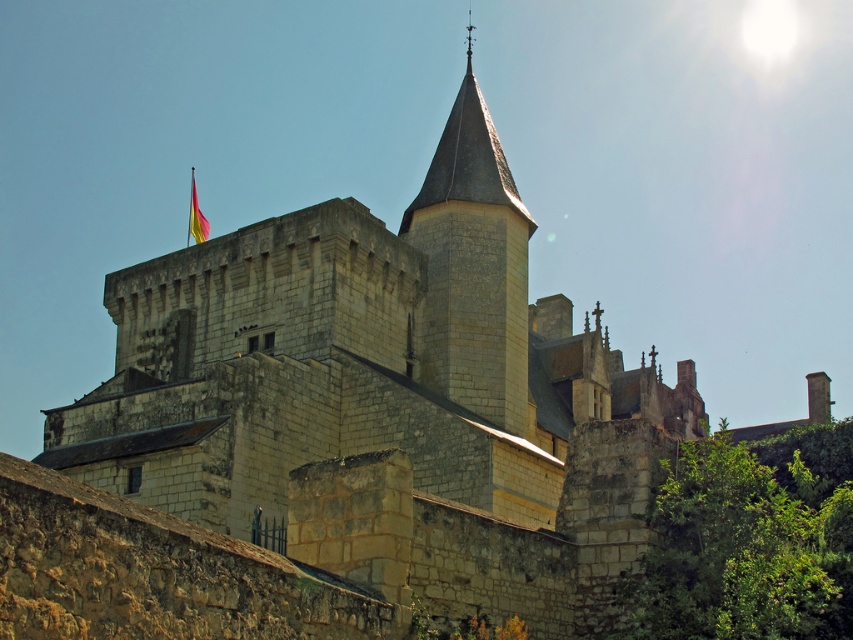
Question: Can you confirm if stone steeple at upper center is positioned to the left of silky yellow flag at upper center?

Choices:
 (A) yes
 (B) no

Answer: (B)

Question: Which point is closer to the camera?

Choices:
 (A) stone steeple at upper center
 (B) silky yellow flag at upper center

Answer: (A)

Question: Which of the following is the closest to the observer?

Choices:
 (A) (450, 376)
 (B) (198, 237)

Answer: (A)

Question: Is stone steeple at upper center to the right of silky yellow flag at upper center from the viewer's perspective?

Choices:
 (A) yes
 (B) no

Answer: (A)

Question: Can you confirm if stone steeple at upper center is positioned above silky yellow flag at upper center?

Choices:
 (A) no
 (B) yes

Answer: (A)

Question: Which object appears farthest from the camera in this image?

Choices:
 (A) stone steeple at upper center
 (B) silky yellow flag at upper center

Answer: (B)